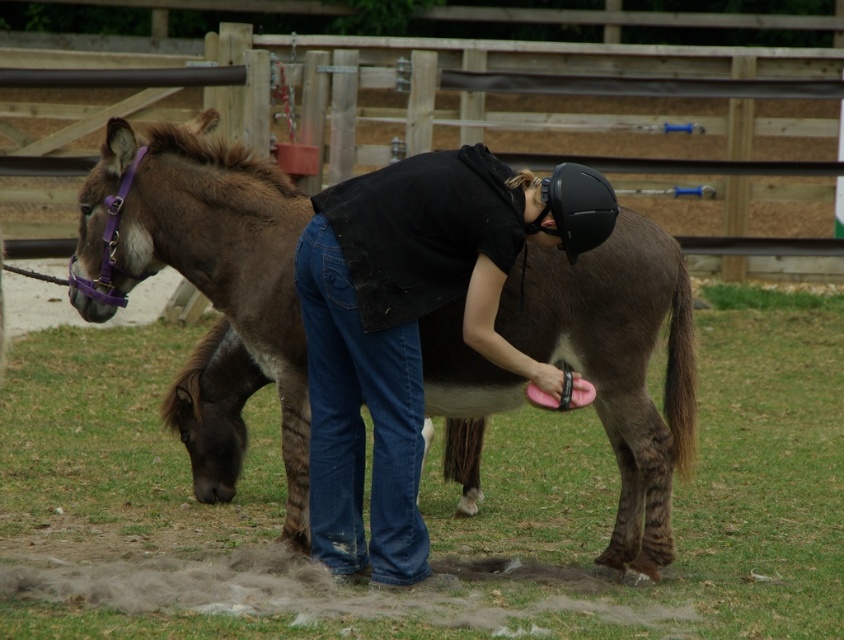
Please provide the 2D coordinates of the brown matte mule at center in the image.

The brown matte mule at center is located at coordinates (214, 289).